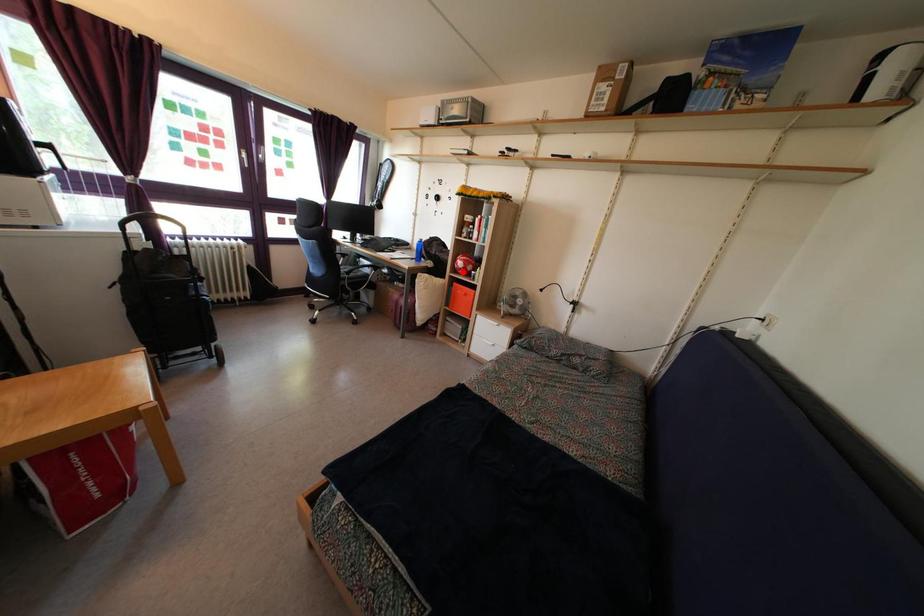
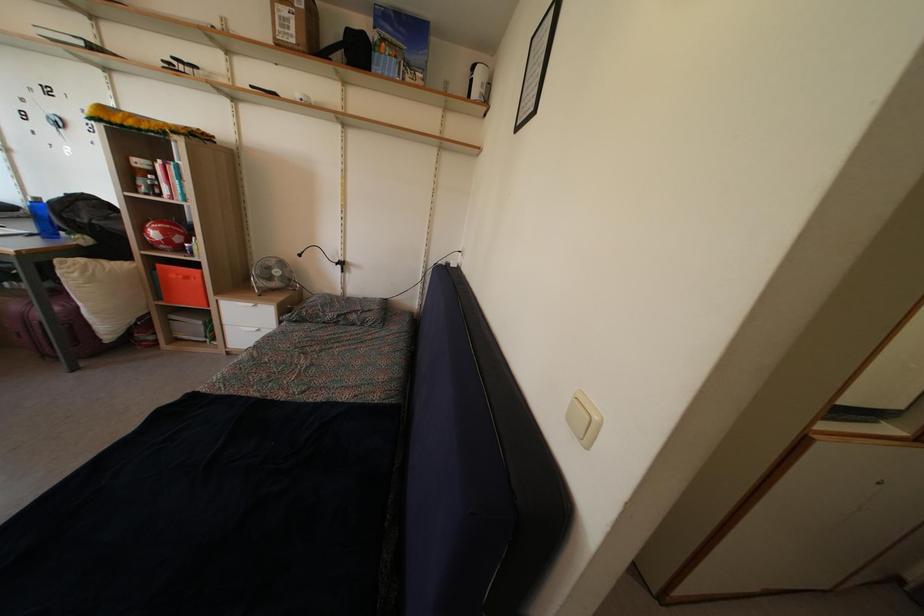
Question: I am providing you with two images of the same scene from different viewpoints. A red point is shown in image1. For the corresponding object point in image2, is it positioned nearer or farther from the camera?

Choices:
 (A) Nearer
 (B) Farther

Answer: (B)